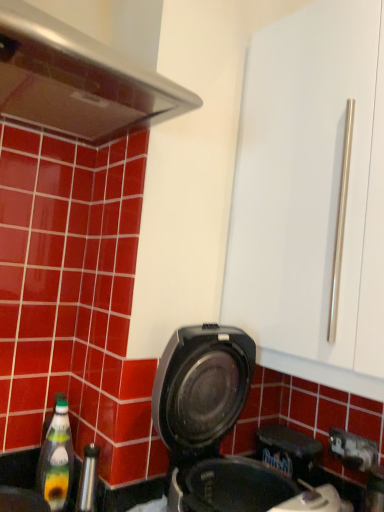
Question: Considering the relative sizes of black plastic waffle maker at lower center and transparent plastic bottle at lower left in the image provided, is black plastic waffle maker at lower center shorter than transparent plastic bottle at lower left?

Choices:
 (A) yes
 (B) no

Answer: (B)

Question: Is black plastic waffle maker at lower center thinner than transparent plastic bottle at lower left?

Choices:
 (A) no
 (B) yes

Answer: (A)

Question: Is black plastic waffle maker at lower center further to the viewer compared to transparent plastic bottle at lower left?

Choices:
 (A) yes
 (B) no

Answer: (B)

Question: Would you consider black plastic waffle maker at lower center to be distant from transparent plastic bottle at lower left?

Choices:
 (A) no
 (B) yes

Answer: (A)

Question: Does black plastic waffle maker at lower center have a larger size compared to transparent plastic bottle at lower left?

Choices:
 (A) yes
 (B) no

Answer: (A)

Question: From the image's perspective, relative to green glass bottle at lower left, is transparent plastic bottle at lower left above or below?

Choices:
 (A) above
 (B) below

Answer: (B)

Question: Is transparent plastic bottle at lower left to the left or to the right of green glass bottle at lower left in the image?

Choices:
 (A) right
 (B) left

Answer: (B)

Question: Is point (31, 460) positioned closer to the camera than point (62, 481)?

Choices:
 (A) farther
 (B) closer

Answer: (A)

Question: Is transparent plastic bottle at lower left inside or outside of green glass bottle at lower left?

Choices:
 (A) outside
 (B) inside

Answer: (A)

Question: Considering the positions of transparent plastic bottle at lower left and black plastic waffle maker at lower center in the image, is transparent plastic bottle at lower left bigger or smaller than black plastic waffle maker at lower center?

Choices:
 (A) small
 (B) big

Answer: (A)

Question: Is transparent plastic bottle at lower left inside the boundaries of black plastic waffle maker at lower center, or outside?

Choices:
 (A) inside
 (B) outside

Answer: (B)

Question: Relative to black plastic waffle maker at lower center, is transparent plastic bottle at lower left in front or behind?

Choices:
 (A) behind
 (B) front

Answer: (A)

Question: From the image's perspective, is transparent plastic bottle at lower left located above or below black plastic waffle maker at lower center?

Choices:
 (A) above
 (B) below

Answer: (B)

Question: From a real-world perspective, relative to transparent plastic bottle at lower left, is green glass bottle at lower left vertically above or below?

Choices:
 (A) above
 (B) below

Answer: (A)

Question: Is green glass bottle at lower left inside or outside of transparent plastic bottle at lower left?

Choices:
 (A) inside
 (B) outside

Answer: (B)